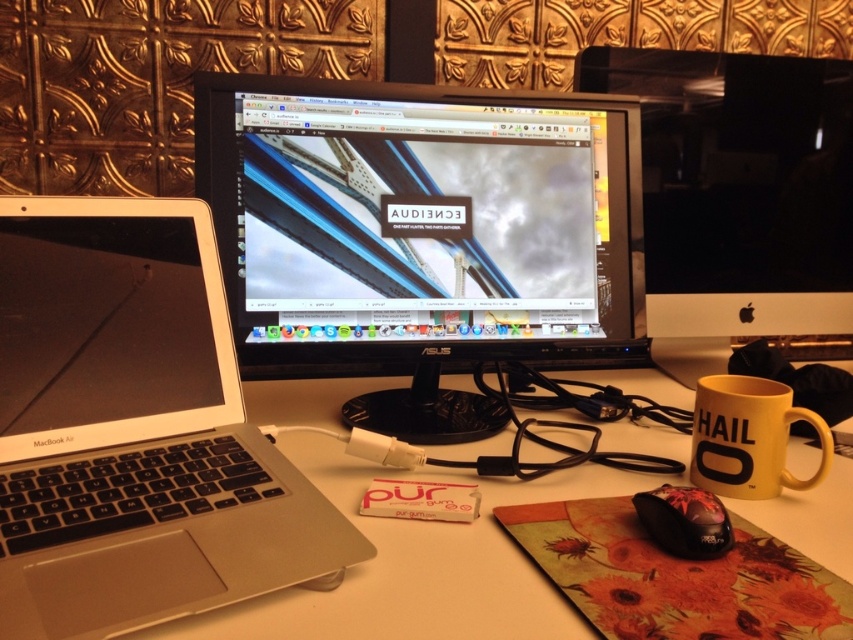
Question: Among these points, which one is farthest from the camera?

Choices:
 (A) (788, 464)
 (B) (851, 257)

Answer: (B)

Question: Estimate the real-world distances between objects in this image. Which object is closer to the black glossy mouse at lower right?

Choices:
 (A) black plastic monitor at center
 (B) yellow matte mug at lower right
 (C) satin black laptop at left
 (D) white plastic computer desk at center

Answer: (B)

Question: Which point is closer to the camera taking this photo?

Choices:
 (A) (827, 161)
 (B) (154, 292)
 (C) (676, 545)
 (D) (399, 538)

Answer: (C)

Question: Can you confirm if satin silver laptop at left is positioned to the right of white plastic computer desk at center?

Choices:
 (A) yes
 (B) no

Answer: (B)

Question: Can you confirm if white plastic computer desk at center is thinner than black glossy monitor at center?

Choices:
 (A) no
 (B) yes

Answer: (A)

Question: Does black plastic monitor at center appear under satin black laptop at left?

Choices:
 (A) no
 (B) yes

Answer: (A)